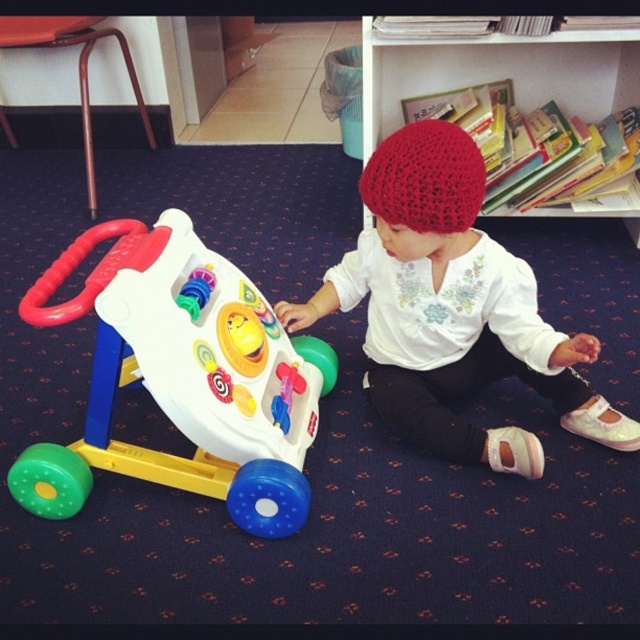
You are a photographer trying to capture a closeup of the white matte shirt at center and the wooden bookshelf at upper center. Which object should you zoom in on to ensure both are in focus without moving the camera?

The white matte shirt at center has a lesser width compared to wooden bookshelf at upper center, so you should zoom in on the white matte shirt at center to ensure both are in focus without moving the camera.

You are a photographer wanting to capture the white matte shirt at center and the wooden bookshelf at upper center in the same frame. Based on their sizes, which object would appear larger in the photo?

The white matte shirt at center would appear larger in the photo since it is much taller than the wooden bookshelf at upper center.